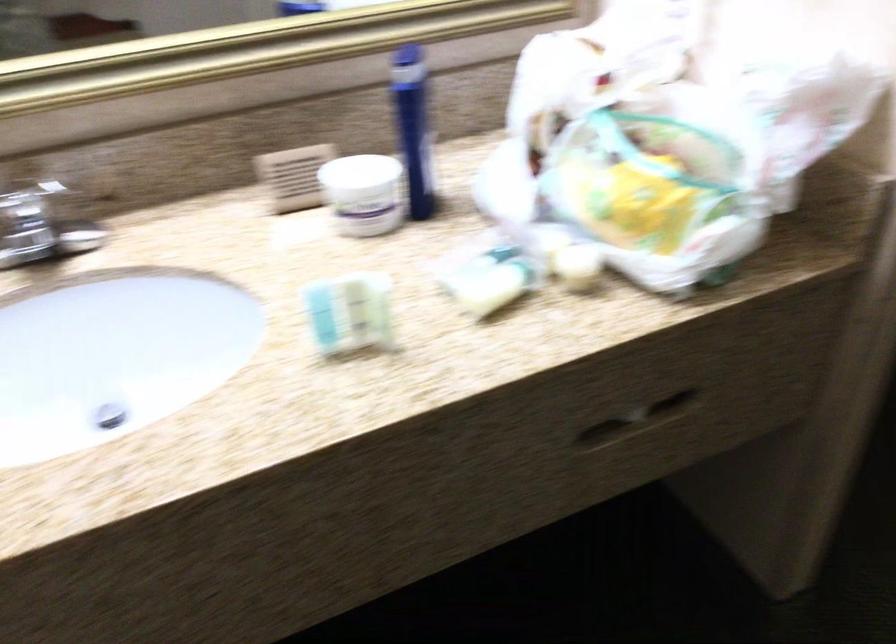
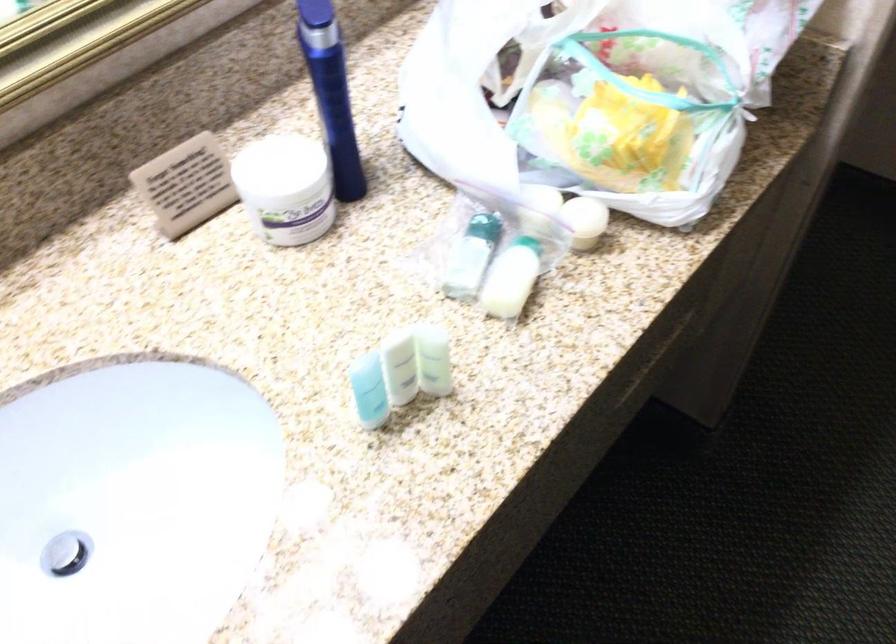
Find the pixel in the second image that matches the point at 409,118 in the first image.

(331, 93)